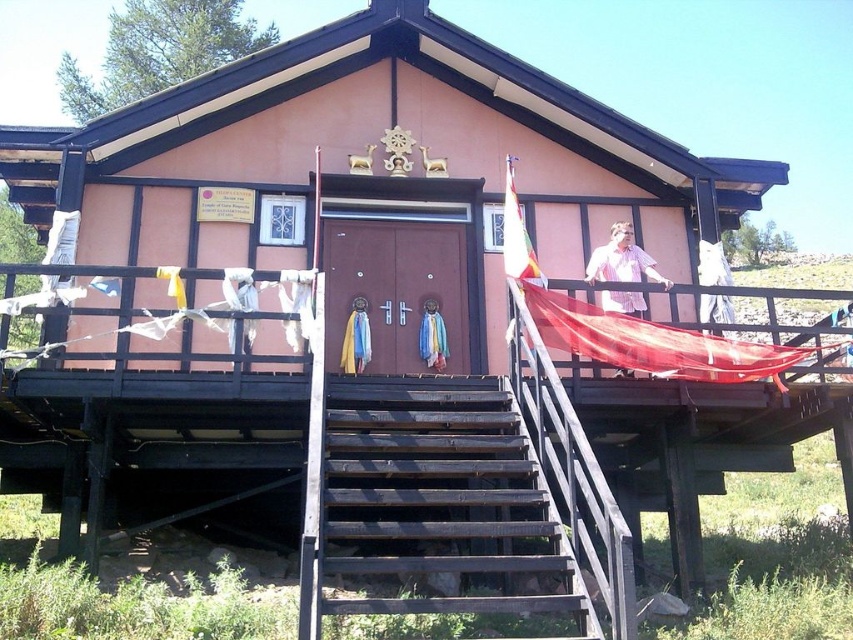
Is dark brown wooden stairs at center thinner than pink striped shirt at upper center?

In fact, dark brown wooden stairs at center might be wider than pink striped shirt at upper center.

Where is `dark brown wooden stairs at center`? This screenshot has height=640, width=853. dark brown wooden stairs at center is located at coordinates (440, 502).